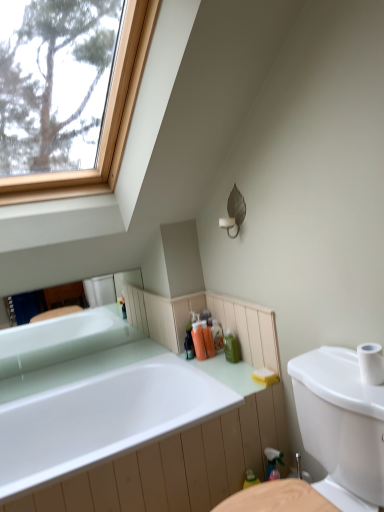
Question: Is white matte toilet paper at right far from white glossy bathtub at upper left, placed as the first bathtub when sorted from top to bottom?

Choices:
 (A) yes
 (B) no

Answer: (A)

Question: Can white glossy bathtub at upper left, which appears as the second bathtub when ordered from the bottom, be found inside white matte toilet paper at right?

Choices:
 (A) no
 (B) yes

Answer: (A)

Question: Does white matte toilet paper at right have a greater height compared to white glossy bathtub at upper left, placed as the first bathtub when sorted from top to bottom?

Choices:
 (A) no
 (B) yes

Answer: (A)

Question: Is white matte toilet paper at right positioned in front of white glossy bathtub at upper left, placed as the first bathtub when sorted from top to bottom?

Choices:
 (A) yes
 (B) no

Answer: (A)

Question: Does white matte toilet paper at right have a lesser width compared to white glossy bathtub at upper left, placed as the first bathtub when sorted from top to bottom?

Choices:
 (A) no
 (B) yes

Answer: (A)

Question: Considering the positions of point (142, 366) and point (215, 339), is point (142, 366) closer or farther from the camera than point (215, 339)?

Choices:
 (A) closer
 (B) farther

Answer: (A)

Question: Visually, is white glossy bathtub at center, which is counted as the 1th bathtub, starting from the bottom, positioned to the left or to the right of translucent plastic bottles at center, which appears as the 3th toiletry when viewed from the left?

Choices:
 (A) left
 (B) right

Answer: (A)

Question: From the image's perspective, is white glossy bathtub at center, which is counted as the 1th bathtub, starting from the bottom, above or below translucent plastic bottles at center, which is counted as the 2th toiletry, starting from the right?

Choices:
 (A) below
 (B) above

Answer: (A)

Question: Is white glossy bathtub at center, which appears as the 2th bathtub when viewed from the top, wider or thinner than translucent plastic bottles at center, which appears as the 3th toiletry when viewed from the left?

Choices:
 (A) wide
 (B) thin

Answer: (A)

Question: Is translucent plastic bottles at center, which is counted as the 2th toiletry, starting from the right, bigger or smaller than white glossy bathtub at center, which is counted as the 1th bathtub, starting from the bottom?

Choices:
 (A) small
 (B) big

Answer: (A)

Question: Is translucent plastic bottles at center, which appears as the 3th toiletry when viewed from the left, inside or outside of white glossy bathtub at center, which is counted as the 1th bathtub, starting from the bottom?

Choices:
 (A) inside
 (B) outside

Answer: (B)

Question: From a real-world perspective, is translucent plastic bottles at center, which appears as the 3th toiletry when viewed from the left, above or below white glossy bathtub at center, which is counted as the 1th bathtub, starting from the bottom?

Choices:
 (A) above
 (B) below

Answer: (A)

Question: Considering the relative positions of translucent plastic bottles at center, which is counted as the 2th toiletry, starting from the right, and white glossy bathtub at center, which is counted as the 1th bathtub, starting from the bottom, in the image provided, is translucent plastic bottles at center, which is counted as the 2th toiletry, starting from the right, to the left or to the right of white glossy bathtub at center, which is counted as the 1th bathtub, starting from the bottom,?

Choices:
 (A) right
 (B) left

Answer: (A)

Question: Considering the positions of point (208, 355) and point (233, 344), is point (208, 355) closer or farther from the camera than point (233, 344)?

Choices:
 (A) closer
 (B) farther

Answer: (B)

Question: From a real-world perspective, is translucent orange soap at center, positioned as the 3th toiletry in right-to-left order, physically located above or below green matte bottle at center, the fourth toiletry from the left?

Choices:
 (A) below
 (B) above

Answer: (B)